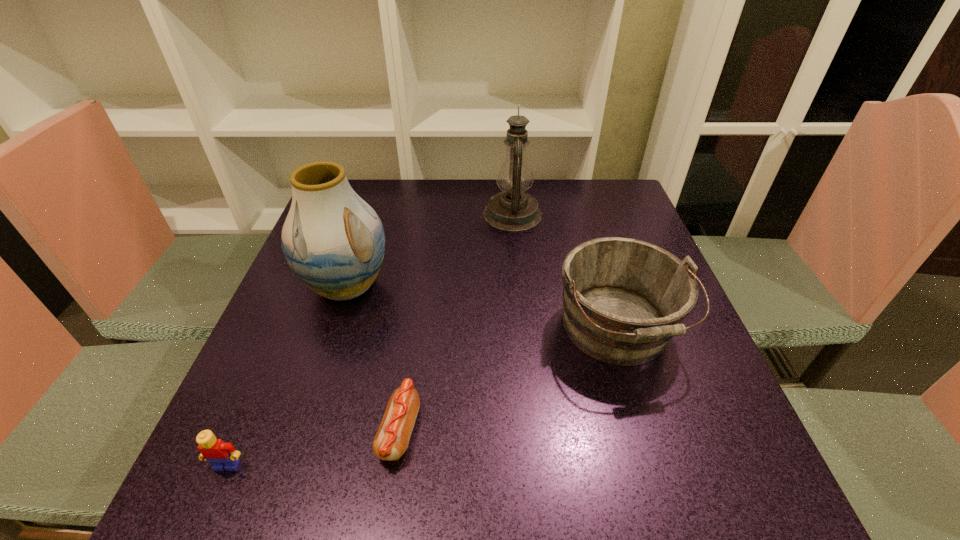
Locate an element on the screen. vacant space at the left edge of the desktop is located at coordinates (282, 357).

This screenshot has height=540, width=960. I want to click on vacant region at the right edge of the desktop, so click(x=639, y=403).

Identify the location of free space at the far left corner of the desktop. The height and width of the screenshot is (540, 960). (383, 186).

Where is `blank space at the far right corner of the desktop`? The image size is (960, 540). blank space at the far right corner of the desktop is located at coordinates (608, 197).

Where is `free space at the near right corner`? This screenshot has height=540, width=960. free space at the near right corner is located at coordinates (734, 495).

Where is `vacant region between the Lego and the farthest object`? This screenshot has width=960, height=540. vacant region between the Lego and the farthest object is located at coordinates (370, 340).

The image size is (960, 540). What are the coordinates of `vacant area between the vase and the wine bucket` in the screenshot? It's located at (482, 308).

The height and width of the screenshot is (540, 960). I want to click on vacant area that lies between the vase and the sausage, so click(373, 358).

Image resolution: width=960 pixels, height=540 pixels. Identify the location of free spot between the Lego and the farthest object. (370, 340).

Find the location of `free space between the shortest object and the vase`. free space between the shortest object and the vase is located at coordinates (373, 358).